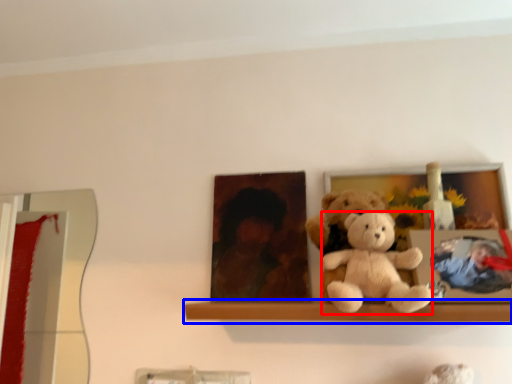
Question: Which of the following is the farthest to the observer, teddy bear (highlighted by a red box) or window sill (highlighted by a blue box)?

Choices:
 (A) teddy bear
 (B) window sill

Answer: (B)